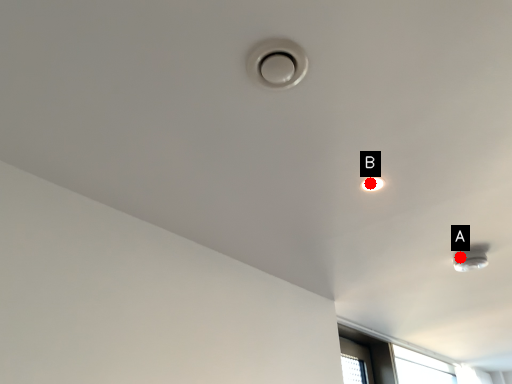
Question: Two points are circled on the image, labeled by A and B beside each circle. Which of the following is the closest to the observer?

Choices:
 (A) A is closer
 (B) B is closer

Answer: (B)